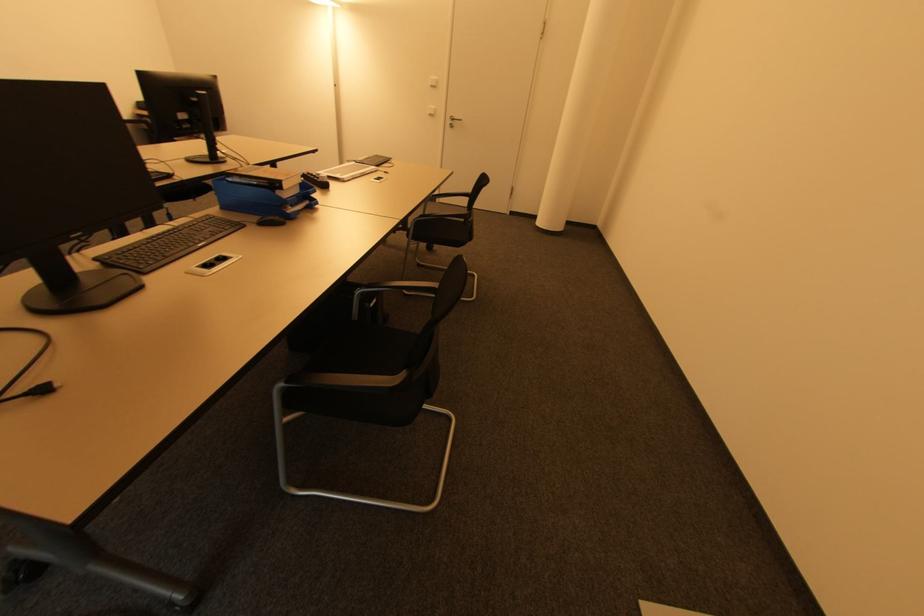
Describe the element at coordinates (398, 288) in the screenshot. I see `the chair armrest` at that location.